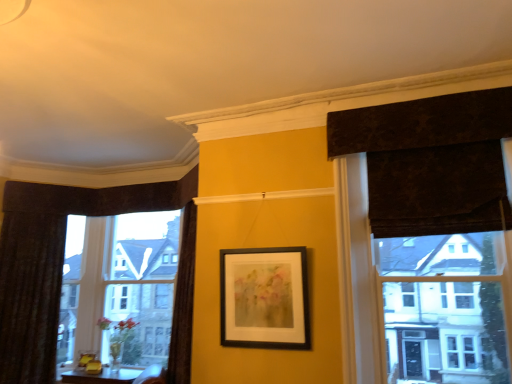
Question: In terms of width, does black matte picture frame at center look wider or thinner when compared to dark textured curtain at upper right, the second curtain in the back-to-front sequence?

Choices:
 (A) thin
 (B) wide

Answer: (A)

Question: From their relative heights in the image, would you say black matte picture frame at center is taller or shorter than dark textured curtain at upper right, the first curtain in the front-to-back sequence?

Choices:
 (A) short
 (B) tall

Answer: (A)

Question: Which object is the farthest from the velvet dark brown curtain at left, positioned as the second curtain in right-to-left order?

Choices:
 (A) black matte picture frame at center
 (B) dark textured curtain at upper right, positioned as the 1th curtain in right-to-left order
 (C) clear glass window at left

Answer: (B)

Question: Which object is the farthest from the dark textured curtain at upper right, positioned as the 1th curtain in right-to-left order?

Choices:
 (A) black matte picture frame at center
 (B) clear glass window at left
 (C) velvet dark brown curtain at left, the second curtain viewed from the front

Answer: (B)